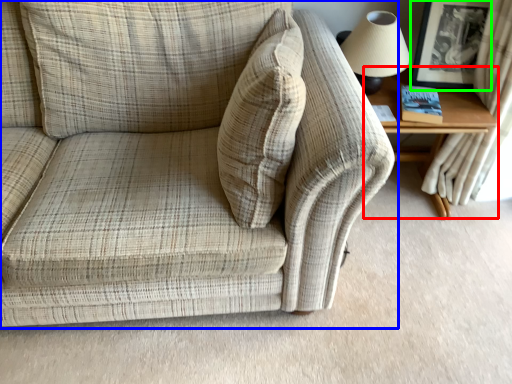
Question: Considering the real-world distances, which object is farthest from table (highlighted by a red box)? studio couch (highlighted by a blue box) or picture frame (highlighted by a green box)?

Choices:
 (A) studio couch
 (B) picture frame

Answer: (A)